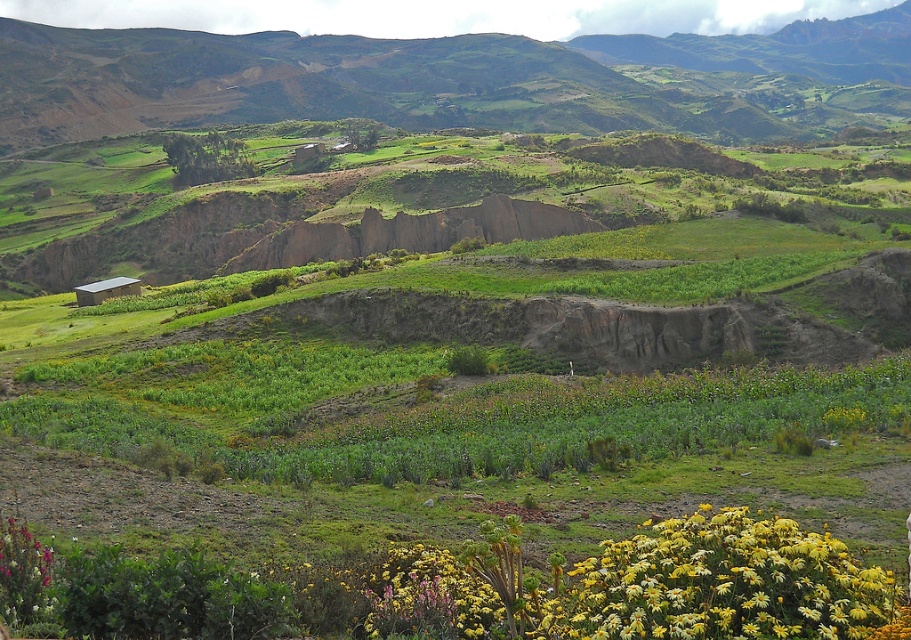
Question: Is green grassy hill at upper center positioned in front of yellow matte flower at lower right?

Choices:
 (A) no
 (B) yes

Answer: (A)

Question: Is green grassy hill at upper center to the right of yellow matte flower at lower right from the viewer's perspective?

Choices:
 (A) no
 (B) yes

Answer: (B)

Question: Can you confirm if green grassy hill at upper center is thinner than yellow matte flower at lower right?

Choices:
 (A) no
 (B) yes

Answer: (A)

Question: Which point appears farthest from the camera in this image?

Choices:
 (A) (800, 544)
 (B) (16, 93)

Answer: (B)

Question: Which of the following is the closest to the observer?

Choices:
 (A) (650, 586)
 (B) (874, 67)

Answer: (A)